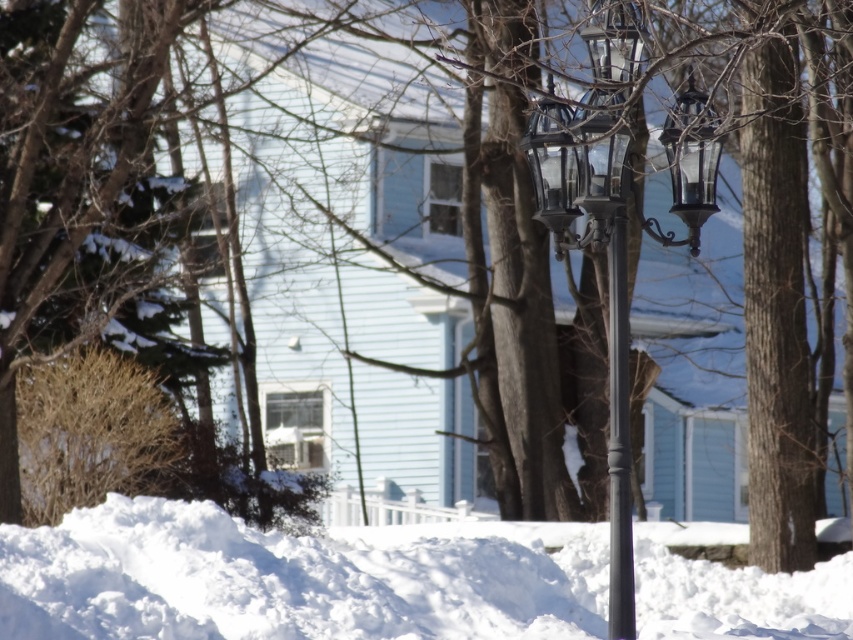
Based on the photo, does white fluffy snow at lower center have a greater width compared to glossy metal lamp post at center?

Correct, the width of white fluffy snow at lower center exceeds that of glossy metal lamp post at center.

Does point (373, 548) come in front of point (622, 211)?

No, it is not.

The height and width of the screenshot is (640, 853). I want to click on white fluffy snow at lower center, so click(x=296, y=577).